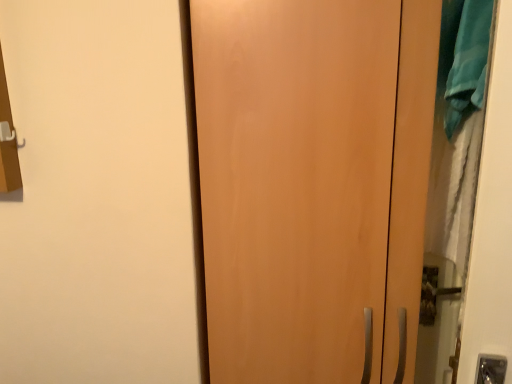
Question: Should I look upward or downward to see matte wood door at center?

Choices:
 (A) down
 (B) up

Answer: (A)